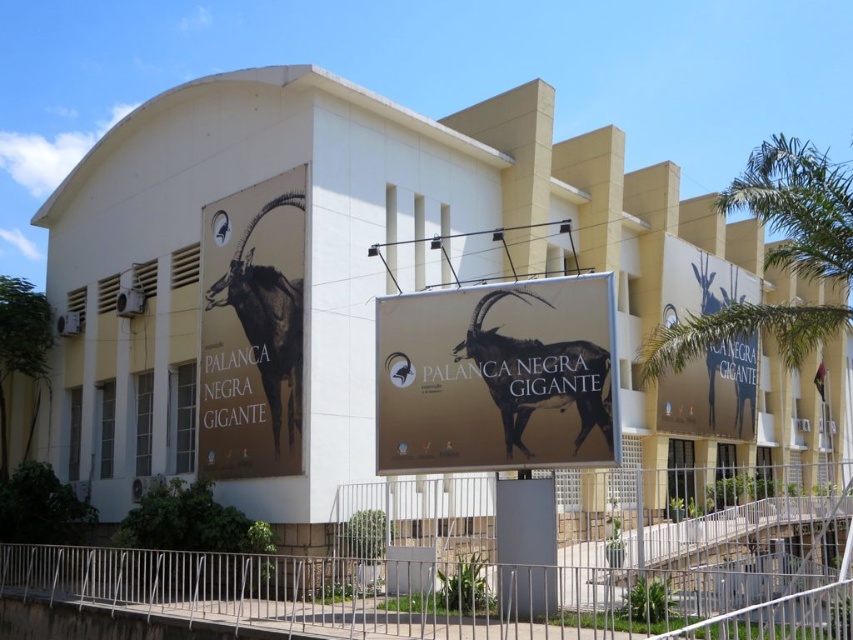
Which is above, gold matte sign at center or black glossy ibex at left?

black glossy ibex at left is higher up.

Who is positioned more to the left, gold matte sign at center or black glossy ibex at left?

black glossy ibex at left

Measure the distance between point (410, 394) and camera.

They are 46.50 feet apart.

This screenshot has height=640, width=853. What are the coordinates of `gold matte sign at center` in the screenshot? It's located at (497, 376).

Is point (535, 608) closer to viewer compared to point (270, 342)?

Yes, it is in front of point (270, 342).

The height and width of the screenshot is (640, 853). What are the coordinates of `metallic silver fence at lower center` in the screenshot? It's located at (442, 595).

Who is higher up, gold matte sign at center or matte gold sign at upper right?

Positioned higher is matte gold sign at upper right.

Is point (426, 435) positioned after point (699, 284)?

No, (426, 435) is closer to viewer.

Identify the location of gold matte sign at center. (497, 376).